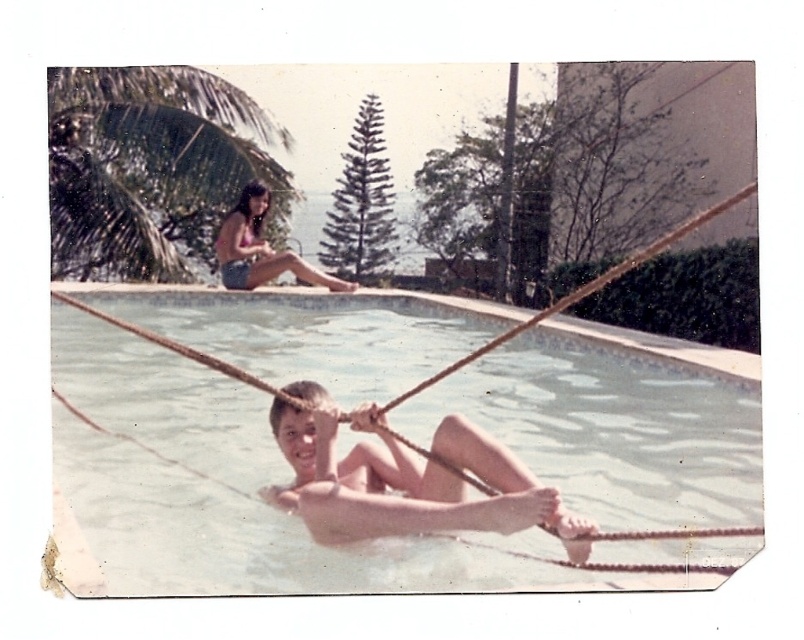
Which of these two, clear plastic water at center or matte pink bikini top at upper left, stands taller?

clear plastic water at center is taller.

Consider the image. Who is shorter, clear plastic water at center or matte pink bikini top at upper left?

matte pink bikini top at upper left

Is point (81, 460) behind point (243, 250)?

No, (81, 460) is closer to viewer.

Identify the location of clear plastic water at center. The image size is (804, 640). (230, 492).

Which is more to the left, clear plastic water at center or smooth skin child at center?

From the viewer's perspective, clear plastic water at center appears more on the left side.

Is point (87, 368) farther from viewer compared to point (513, 506)?

Yes.

Image resolution: width=804 pixels, height=640 pixels. Identify the location of clear plastic water at center. (230, 492).

Which of these two, green leafy palm tree at upper left or smooth skin child at center, stands shorter?

Standing shorter between the two is smooth skin child at center.

How much distance is there between green leafy palm tree at upper left and smooth skin child at center?

green leafy palm tree at upper left and smooth skin child at center are 10.62 meters apart from each other.

Is point (175, 168) farther from camera compared to point (450, 522)?

Yes.

You are a GUI agent. You are given a task and a screenshot of the screen. Output one action in this format:
    pyautogui.click(x=<x>, y=<y>)
    Task: Click on the green leafy palm tree at upper left
    The width and height of the screenshot is (804, 640).
    Given the screenshot: What is the action you would take?
    pyautogui.click(x=148, y=168)